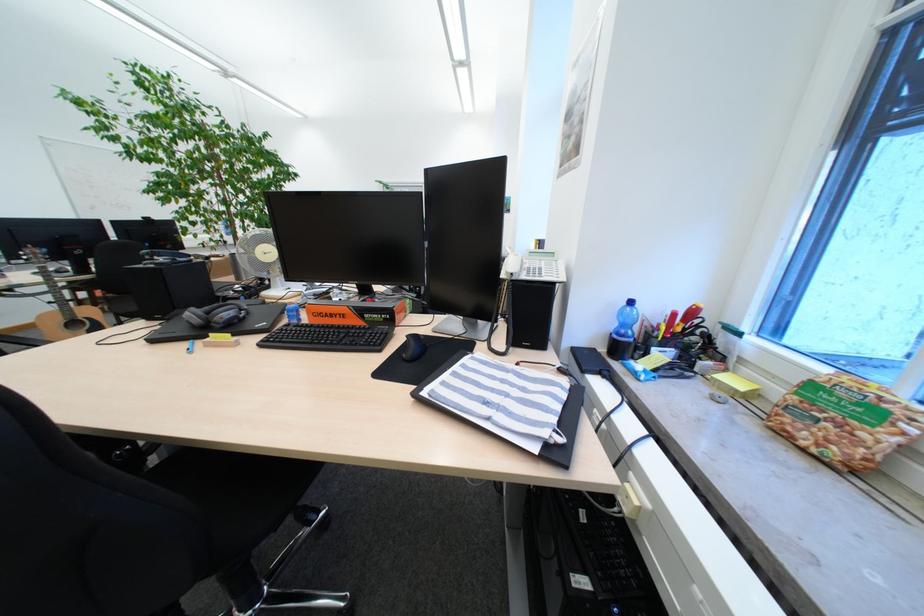
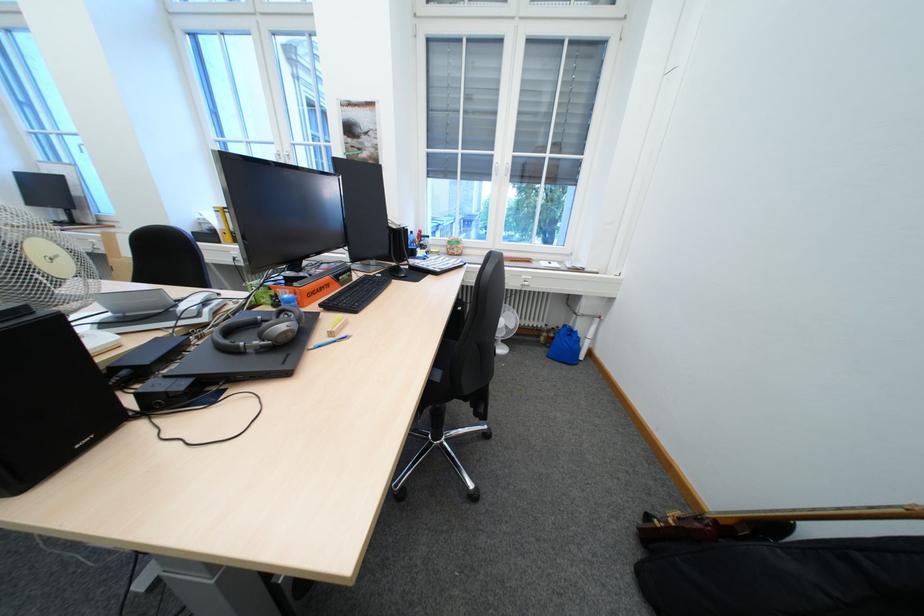
Where in the second image is the point corresponding to pixel 355 317 from the first image?

(339, 286)